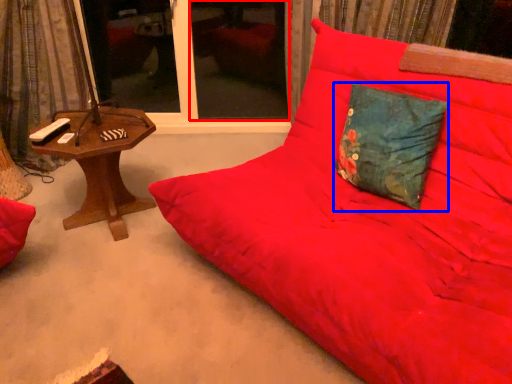
Question: Which point is further to the camera, window screen (highlighted by a red box) or pillow (highlighted by a blue box)?

Choices:
 (A) window screen
 (B) pillow

Answer: (A)